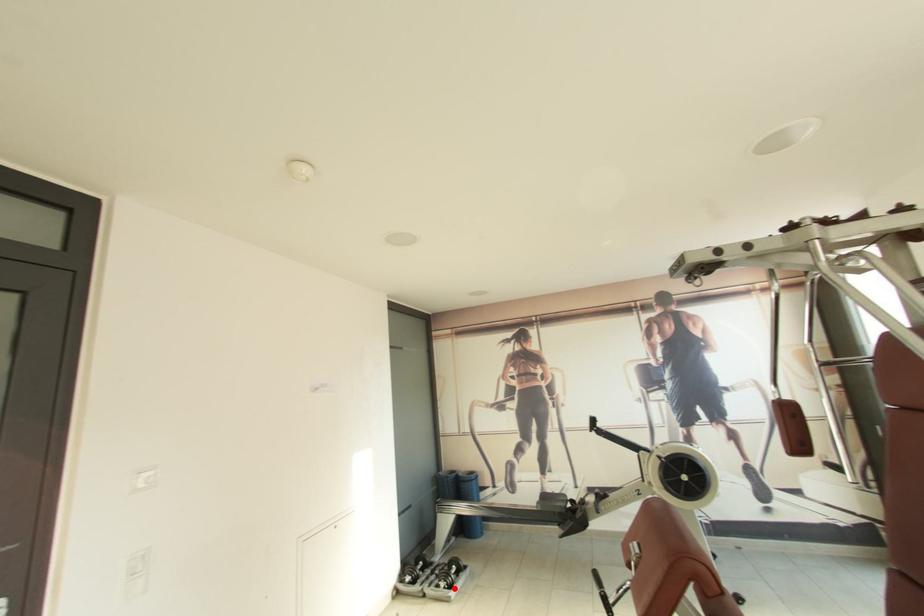
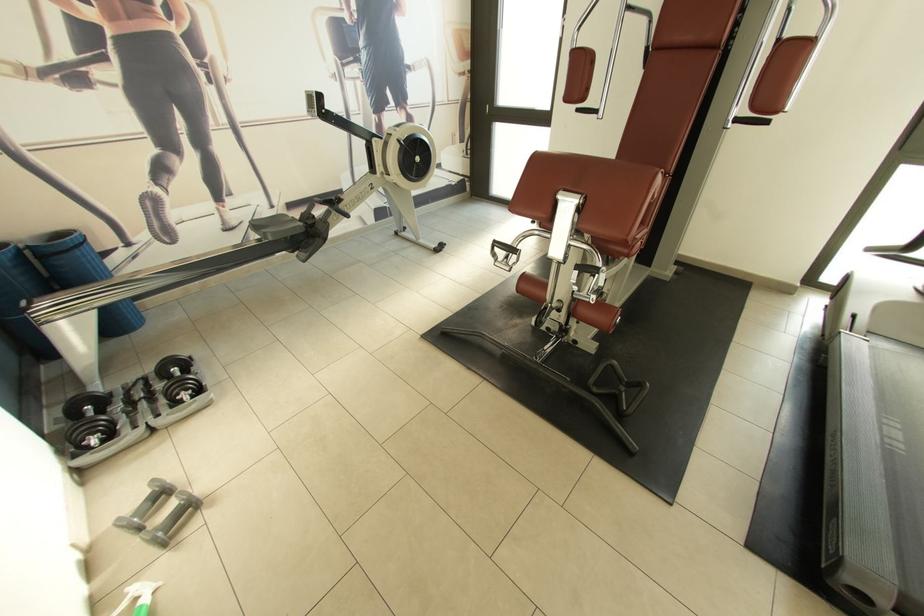
Where in the second image is the point corresponding to the highlighted location from the first image?

(204, 392)